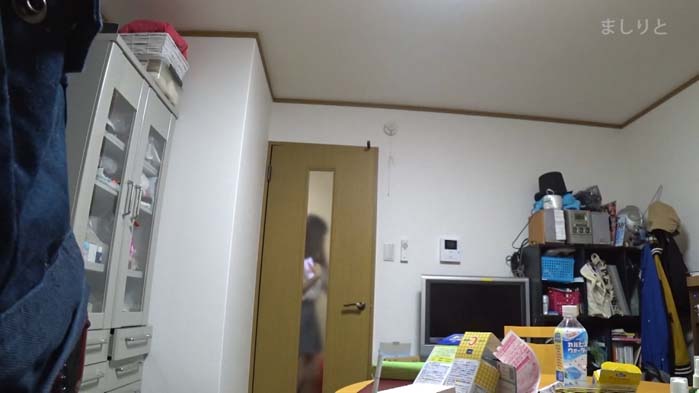
The width and height of the screenshot is (699, 393). Identify the location of door. (354, 227), (284, 235), (275, 353), (345, 349).